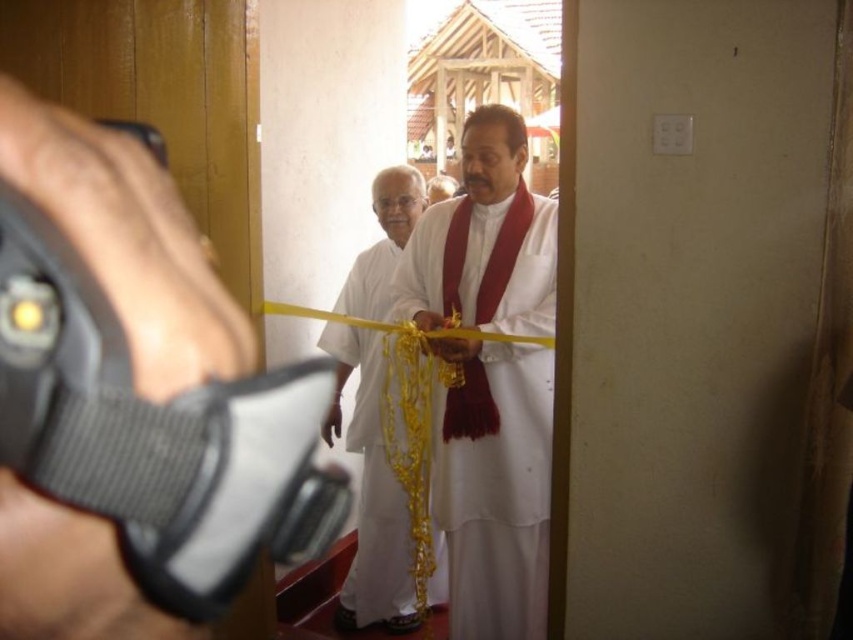
You are standing in the ceremonial event scene described. You need to walk from the first point to the second point. Which direction should you move relative to your current position at point (555, 241) to reach point (368, 257)?

To move from point (555, 241) to point (368, 257), you should move diagonally forward and to the right. Since point (555, 241) is in front of point (368, 257), you need to adjust your direction slightly to the right and backward to reach the second point.

You are standing in front of the wooden door frame and want to take a photo of the white silk dhoti at center. Where should you position yourself to capture it in the frame?

To capture the white silk dhoti at center in the frame, you should position yourself directly in front of it, aligning your camera with its coordinates at point (x=494, y=486).